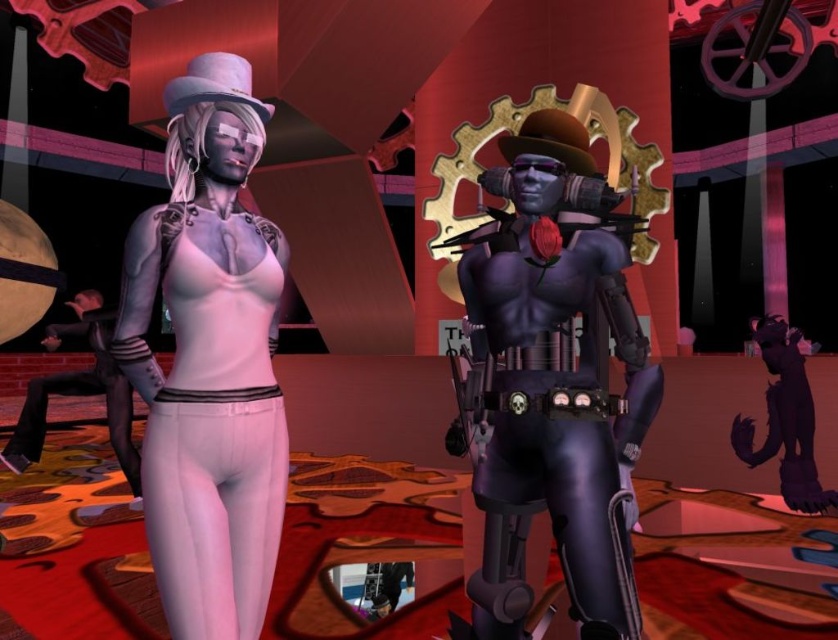
Question: Can you confirm if matte white skin at left is positioned above matte black leather pants at left?

Choices:
 (A) yes
 (B) no

Answer: (A)

Question: Estimate the real-world distances between objects in this image. Which object is closer to the shiny purple armor at center?

Choices:
 (A) matte black leather pants at left
 (B) matte white skin at left

Answer: (B)

Question: Which of these objects is positioned farthest from the shiny purple armor at center?

Choices:
 (A) matte white skin at left
 (B) matte black leather pants at left

Answer: (B)

Question: Is matte white skin at left positioned before matte black leather pants at left?

Choices:
 (A) no
 (B) yes

Answer: (B)

Question: Estimate the real-world distances between objects in this image. Which object is farther from the matte black leather pants at left?

Choices:
 (A) matte white skin at left
 (B) shiny purple armor at center

Answer: (B)

Question: Is shiny purple armor at center smaller than matte black leather pants at left?

Choices:
 (A) no
 (B) yes

Answer: (A)